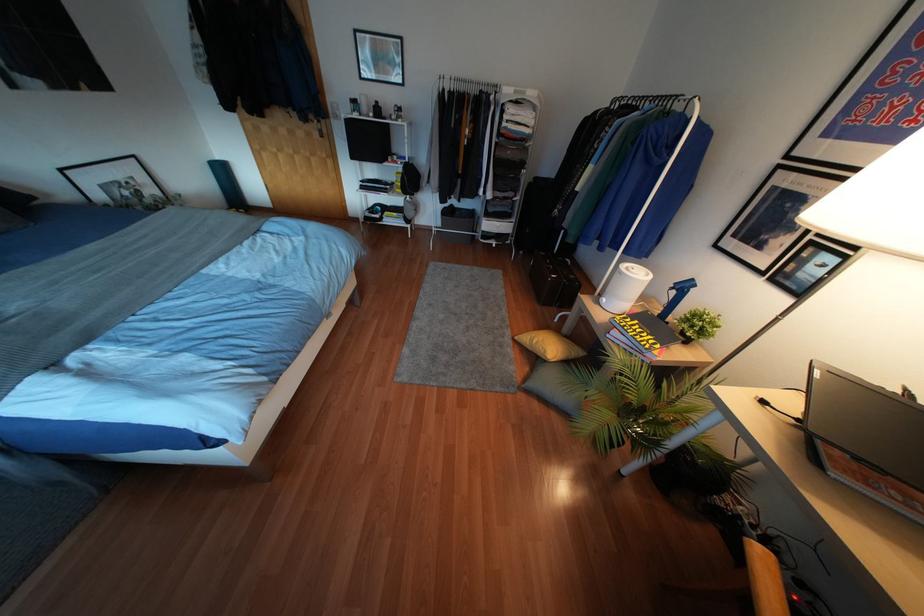
Locate an element on the screen. suitcase handle is located at coordinates (554, 289).